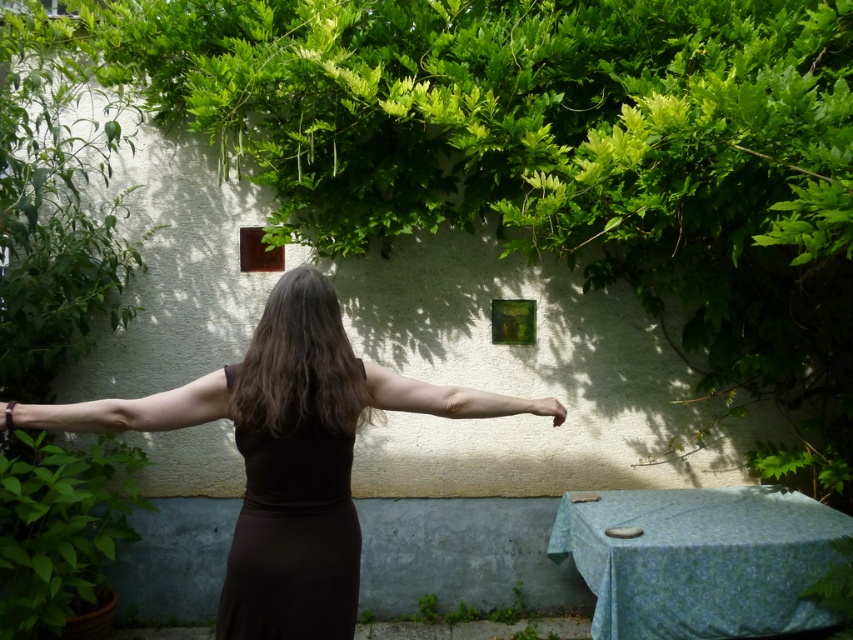
Question: Which object is the farthest from the black matte dress at center?

Choices:
 (A) matte black hand at center
 (B) brown smooth hair at center
 (C) matte brown bracelet at lower left

Answer: (A)

Question: From the image, what is the correct spatial relationship of brown smooth hair at center in relation to smooth skin arm at center?

Choices:
 (A) below
 (B) above

Answer: (B)

Question: Does brown smooth hair at center appear over matte black hand at center?

Choices:
 (A) yes
 (B) no

Answer: (A)

Question: Which of the following is the farthest from the observer?

Choices:
 (A) (256, 586)
 (B) (548, 397)
 (C) (198, 381)
 (D) (503, 412)

Answer: (B)

Question: Can you confirm if brown matte dress at center is positioned to the right of matte skin arm at center?

Choices:
 (A) yes
 (B) no

Answer: (B)

Question: Which point is farther to the camera?

Choices:
 (A) (238, 593)
 (B) (323, 532)
 (C) (537, 410)

Answer: (C)